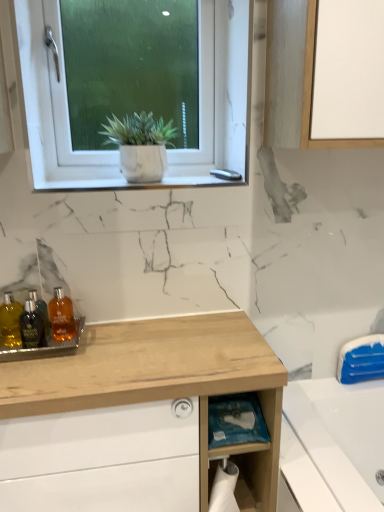
Question: Should I look upward or downward to see white marble plant pot at upper center?

Choices:
 (A) down
 (B) up

Answer: (B)

Question: Is the depth of blue plastic bag at lower center less than that of translucent amber bottle at center, placed as the first toiletry when sorted from right to left?

Choices:
 (A) no
 (B) yes

Answer: (B)

Question: Could you tell me if blue plastic bag at lower center is facing translucent amber bottle at center, placed as the third toiletry when sorted from left to right?

Choices:
 (A) yes
 (B) no

Answer: (B)

Question: Is translucent amber bottle at center, placed as the third toiletry when sorted from left to right, located within blue plastic bag at lower center?

Choices:
 (A) yes
 (B) no

Answer: (B)

Question: Is blue plastic bag at lower center located outside translucent amber bottle at center, placed as the first toiletry when sorted from right to left?

Choices:
 (A) yes
 (B) no

Answer: (A)

Question: Is blue plastic bag at lower center facing away from translucent amber bottle at center, placed as the first toiletry when sorted from right to left?

Choices:
 (A) yes
 (B) no

Answer: (B)

Question: Considering the relative sizes of blue plastic bag at lower center and translucent amber bottle at center, placed as the third toiletry when sorted from left to right, in the image provided, is blue plastic bag at lower center bigger than translucent amber bottle at center, placed as the third toiletry when sorted from left to right,?

Choices:
 (A) yes
 (B) no

Answer: (A)

Question: From the image's perspective, is white marble plant pot at upper center over shiny glass bottles at left, the first toiletry in the left-to-right sequence?

Choices:
 (A) yes
 (B) no

Answer: (A)

Question: Is white marble plant pot at upper center further to camera compared to shiny glass bottles at left, the first toiletry in the left-to-right sequence?

Choices:
 (A) yes
 (B) no

Answer: (A)

Question: Is white marble plant pot at upper center outside of shiny glass bottles at left, the first toiletry in the left-to-right sequence?

Choices:
 (A) no
 (B) yes

Answer: (B)

Question: Is white marble plant pot at upper center closer to the viewer compared to shiny glass bottles at left, the 3th toiletry when ordered from right to left?

Choices:
 (A) yes
 (B) no

Answer: (B)

Question: Does white marble plant pot at upper center have a larger size compared to shiny glass bottles at left, the 3th toiletry when ordered from right to left?

Choices:
 (A) yes
 (B) no

Answer: (A)

Question: From a real-world perspective, is white marble plant pot at upper center on top of shiny glass bottles at left, the first toiletry in the left-to-right sequence?

Choices:
 (A) yes
 (B) no

Answer: (A)

Question: Could you tell me if translucent amber bottle at center, placed as the third toiletry when sorted from left to right, is turned towards shiny glass bottles at left, the first toiletry in the left-to-right sequence?

Choices:
 (A) yes
 (B) no

Answer: (B)